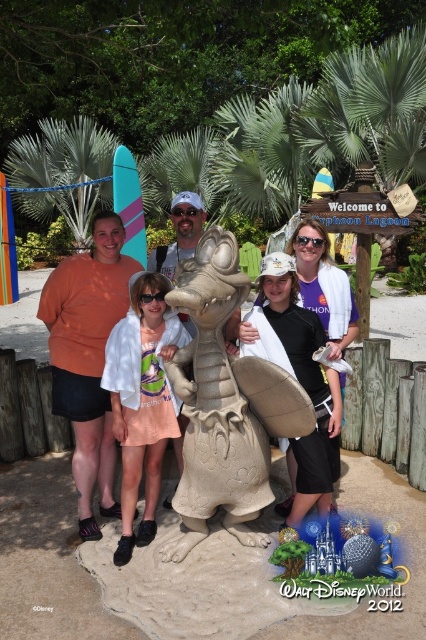
Question: Can you confirm if beige textured sand sculpture at center is positioned below matte sand sculpture of dragon at center?

Choices:
 (A) no
 (B) yes

Answer: (B)

Question: Is white cotton shirt at center bigger than matte sand sculpture of dragon at center?

Choices:
 (A) no
 (B) yes

Answer: (B)

Question: Which point is closer to the camera taking this photo?

Choices:
 (A) (345, 308)
 (B) (155, 499)
 (C) (193, 429)

Answer: (C)

Question: Among these points, which one is farthest from the camera?

Choices:
 (A) (167, 403)
 (B) (180, 237)

Answer: (B)

Question: Can you confirm if beige textured sand sculpture at center is thinner than matte sand sculpture of dragon at center?

Choices:
 (A) yes
 (B) no

Answer: (B)

Question: Which point appears farthest from the camera in this image?

Choices:
 (A) (37, 314)
 (B) (144, 468)

Answer: (A)